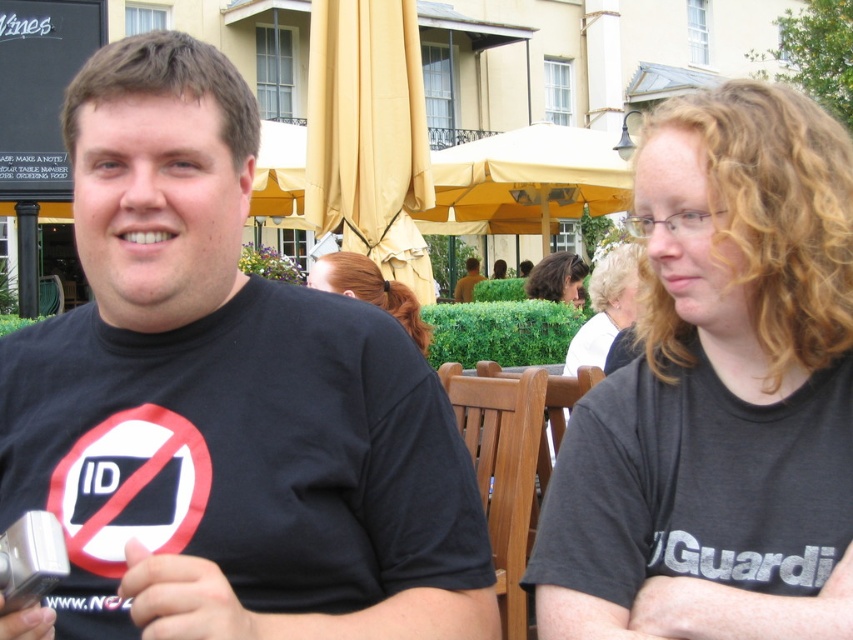
Question: Where is blonde hair at center located in relation to curly hair at center in the image?

Choices:
 (A) right
 (B) left

Answer: (B)

Question: Which object is closer to the camera taking this photo?

Choices:
 (A) curly hair at center
 (B) brown leather jacket at center

Answer: (A)

Question: Can you confirm if dark gray t-shirt at right is positioned below brown leather jacket at center?

Choices:
 (A) no
 (B) yes

Answer: (B)

Question: Which object is the farthest from the black t-shirt at left?

Choices:
 (A) brown leather jacket at center
 (B) dark gray t-shirt at right

Answer: (A)

Question: Which is nearer to the black t-shirt at left?

Choices:
 (A) brown leather jacket at center
 (B) curly hair at center

Answer: (B)

Question: Can you confirm if curly hair at center is wider than brown leather jacket at center?

Choices:
 (A) no
 (B) yes

Answer: (B)